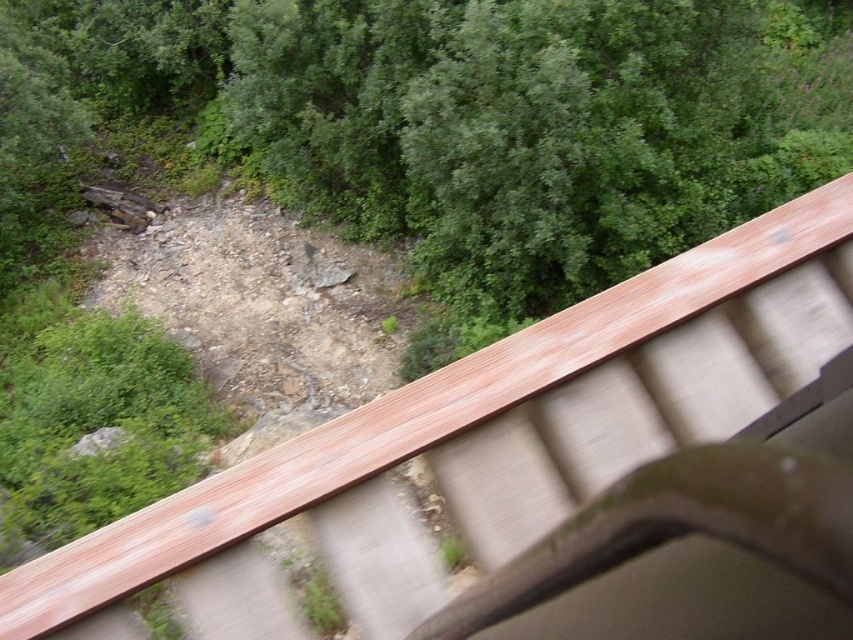
Which of these two, green leafy tree at upper center or wooden rail at upper right, stands shorter?

Standing shorter between the two is wooden rail at upper right.

Between point (606, 115) and point (515, 364), which one is positioned in front?

Point (515, 364)

The height and width of the screenshot is (640, 853). What are the coordinates of `green leafy tree at upper center` in the screenshot? It's located at (482, 120).